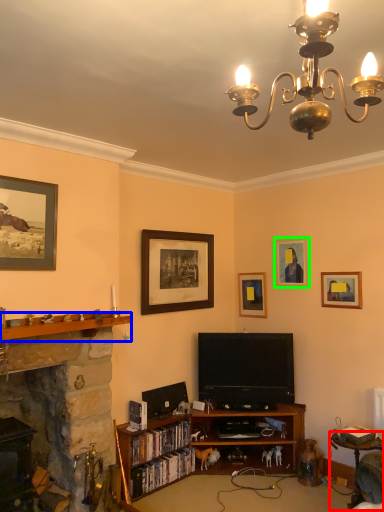
Question: Which object is the closest to the table (highlighted by a red box)? Choose among these: shelf (highlighted by a blue box) or picture frame (highlighted by a green box).

Choices:
 (A) shelf
 (B) picture frame

Answer: (B)